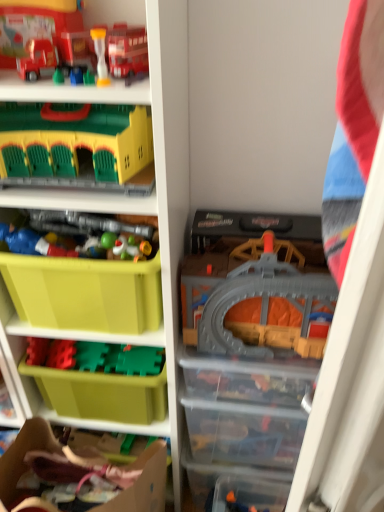
Question: Is plastic toy soldiers at center, acting as the fourth toy starting from the top, next to matte plastic toy at left, placed as the 5th toy when sorted from top to bottom, and touching it?

Choices:
 (A) no
 (B) yes

Answer: (B)

Question: Can you confirm if plastic toy soldiers at center, acting as the fourth toy starting from the top, is bigger than matte plastic toy at left, placed as the 5th toy when sorted from top to bottom?

Choices:
 (A) no
 (B) yes

Answer: (B)

Question: Are plastic toy soldiers at center, the fourth toy ordered from the bottom, and matte plastic toy at left, placed as the 5th toy when sorted from top to bottom, far apart?

Choices:
 (A) yes
 (B) no

Answer: (B)

Question: From a real-world perspective, is plastic toy soldiers at center, acting as the fourth toy starting from the top, beneath matte plastic toy at left, the third toy ordered from the bottom?

Choices:
 (A) no
 (B) yes

Answer: (A)

Question: Is matte plastic toy at left, placed as the 5th toy when sorted from top to bottom, inside plastic toy soldiers at center, acting as the fourth toy starting from the top?

Choices:
 (A) yes
 (B) no

Answer: (B)

Question: Is cardboard at lower left wider or thinner than matte plastic toy car at upper left, which is the 1th toy in top-to-bottom order?

Choices:
 (A) wide
 (B) thin

Answer: (A)

Question: Is cardboard at lower left taller or shorter than matte plastic toy car at upper left, which is the 1th toy in top-to-bottom order?

Choices:
 (A) short
 (B) tall

Answer: (B)

Question: From a real-world perspective, is cardboard at lower left above or below matte plastic toy car at upper left, which is the 1th toy in top-to-bottom order?

Choices:
 (A) below
 (B) above

Answer: (A)

Question: From the image's perspective, relative to matte plastic toy car at upper left, which is the 1th toy in top-to-bottom order, is cardboard at lower left above or below?

Choices:
 (A) above
 (B) below

Answer: (B)

Question: In the image, is matte plastic toy car at upper left, the seventh toy when ordered from bottom to top, positioned in front of or behind cardboard at lower left?

Choices:
 (A) front
 (B) behind

Answer: (A)

Question: Considering the positions of matte plastic toy car at upper left, the seventh toy when ordered from bottom to top, and cardboard at lower left in the image, is matte plastic toy car at upper left, the seventh toy when ordered from bottom to top, wider or thinner than cardboard at lower left?

Choices:
 (A) thin
 (B) wide

Answer: (A)

Question: Is point (1, 50) closer or farther from the camera than point (137, 459)?

Choices:
 (A) closer
 (B) farther

Answer: (A)

Question: Looking at the image, does matte plastic toy car at upper left, the seventh toy when ordered from bottom to top, seem bigger or smaller compared to cardboard at lower left?

Choices:
 (A) big
 (B) small

Answer: (B)

Question: Is gray plastic train set at center, which appears as the 2th toy when ordered from the bottom, in front of or behind matte plastic shelf at center in the image?

Choices:
 (A) front
 (B) behind

Answer: (B)

Question: Would you say gray plastic train set at center, the sixth toy viewed from the top, is to the left or to the right of matte plastic shelf at center in the picture?

Choices:
 (A) left
 (B) right

Answer: (B)